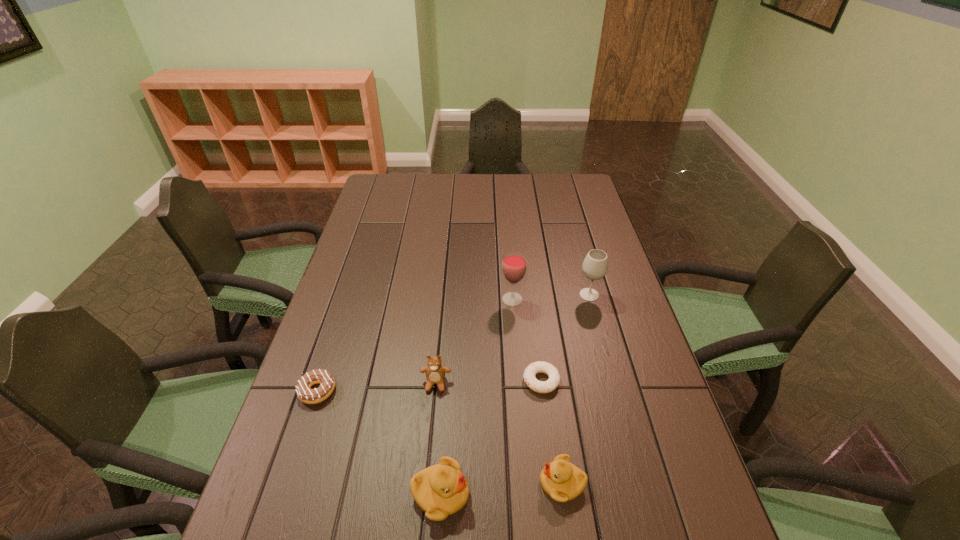
Identify the location of object located in the right edge section of the desktop. (595, 266).

I want to click on blank space at the far edge of the desktop, so click(486, 181).

Identify the location of blank area at the near edge. (347, 504).

The image size is (960, 540). In order to click on vacant space at the left edge of the desktop in this screenshot , I will do `click(350, 315)`.

Identify the location of vacant space at the right edge of the desktop. Image resolution: width=960 pixels, height=540 pixels. (625, 453).

Where is `vacant space at the far right corner`? This screenshot has width=960, height=540. vacant space at the far right corner is located at coordinates (552, 181).

Find the location of a particular element. free space between the third shortest object and the rightmost object is located at coordinates (576, 389).

At what (x,y) coordinates should I click in order to perform the action: click on free space that is in between the shorter doughnut and the right duckling. Please return your answer as a coordinate pair (x, y). Looking at the image, I should click on (552, 432).

Where is `vacant area that lies between the shorter doughnut and the teddy bear`? Image resolution: width=960 pixels, height=540 pixels. vacant area that lies between the shorter doughnut and the teddy bear is located at coordinates (489, 382).

I want to click on vacant area that lies between the fifth tallest object and the leftmost object, so click(x=440, y=437).